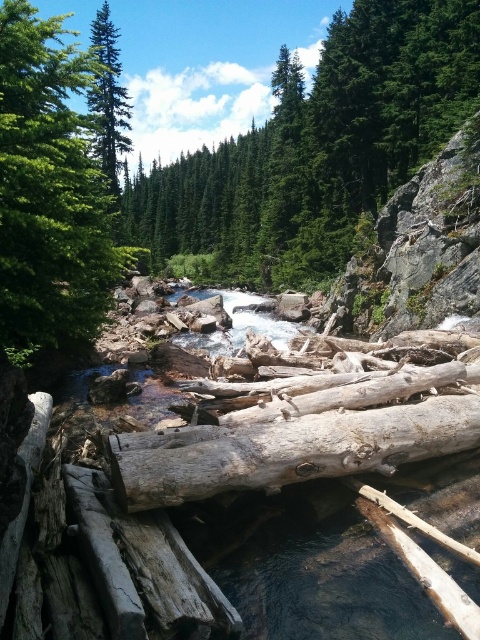
Does green textured tree at upper left appear under green matte tree at upper left?

Actually, green textured tree at upper left is above green matte tree at upper left.

Can you confirm if green textured tree at upper left is positioned above green matte tree at upper left?

Yes, green textured tree at upper left is above green matte tree at upper left.

At what (x,y) coordinates should I click in order to perform the action: click on green textured tree at upper left. Please return your answer as a coordinate pair (x, y). Looking at the image, I should click on (49, 193).

At what (x,y) coordinates should I click in order to perform the action: click on green textured tree at upper left. Please return your answer as a coordinate pair (x, y). Image resolution: width=480 pixels, height=640 pixels. Looking at the image, I should click on (49, 193).

Can you confirm if weathered wood log at center is positioned below green matte tree at upper left?

Indeed, weathered wood log at center is positioned under green matte tree at upper left.

Does point (257, 435) come farther from viewer compared to point (129, 109)?

No, it is not.

Is point (251, 486) less distant than point (97, 61)?

That is True.

Locate an element on the screen. The image size is (480, 640). weathered wood log at center is located at coordinates (287, 451).

Which is in front, point (397, 52) or point (112, 84)?

Positioned in front is point (397, 52).

Which is behind, point (310, 154) or point (127, 97)?

Point (127, 97)

Where is `green textured tree at upper center`? This screenshot has width=480, height=640. green textured tree at upper center is located at coordinates (319, 147).